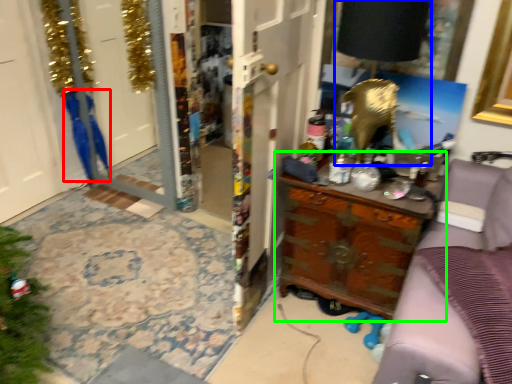
Question: Which is farther away from robe (highlighted by a red box)? lamp (highlighted by a blue box) or chest of drawers (highlighted by a green box)?

Choices:
 (A) lamp
 (B) chest of drawers

Answer: (A)